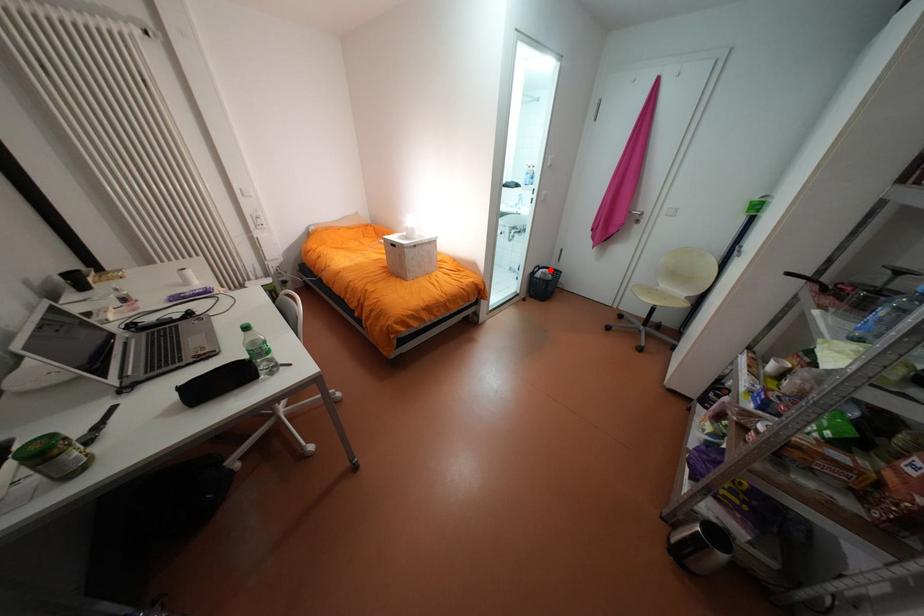
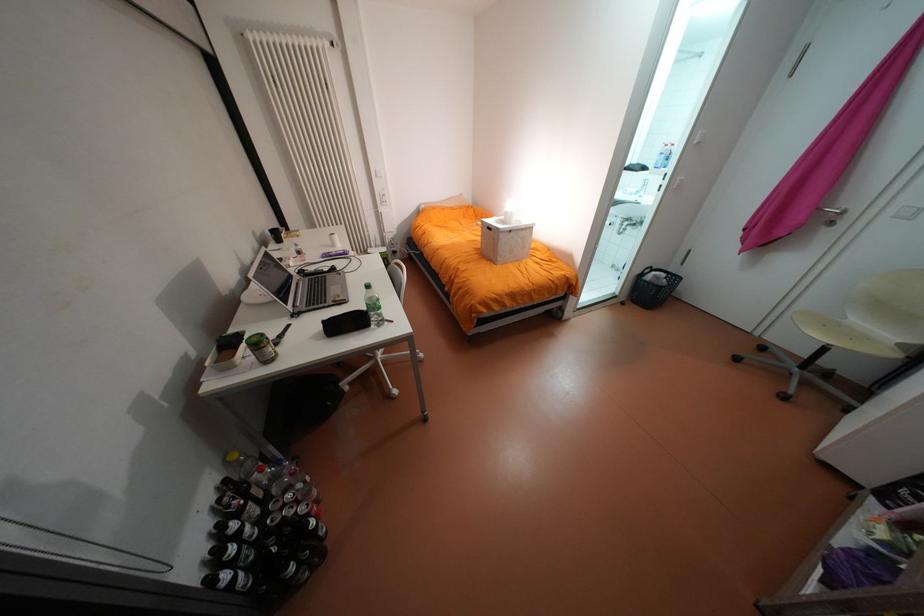
Find the pixel in the second image that matches the highlighted location in the first image.

(663, 273)